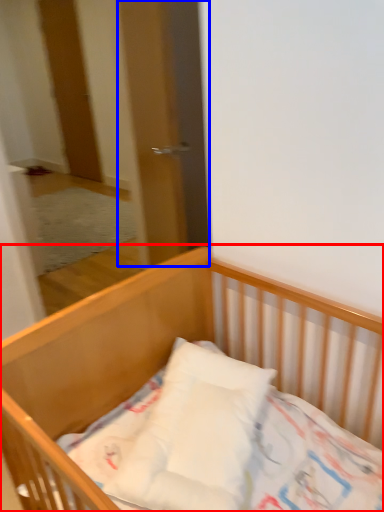
Question: Which point is further to the camera, bed (highlighted by a red box) or screen door (highlighted by a blue box)?

Choices:
 (A) bed
 (B) screen door

Answer: (B)